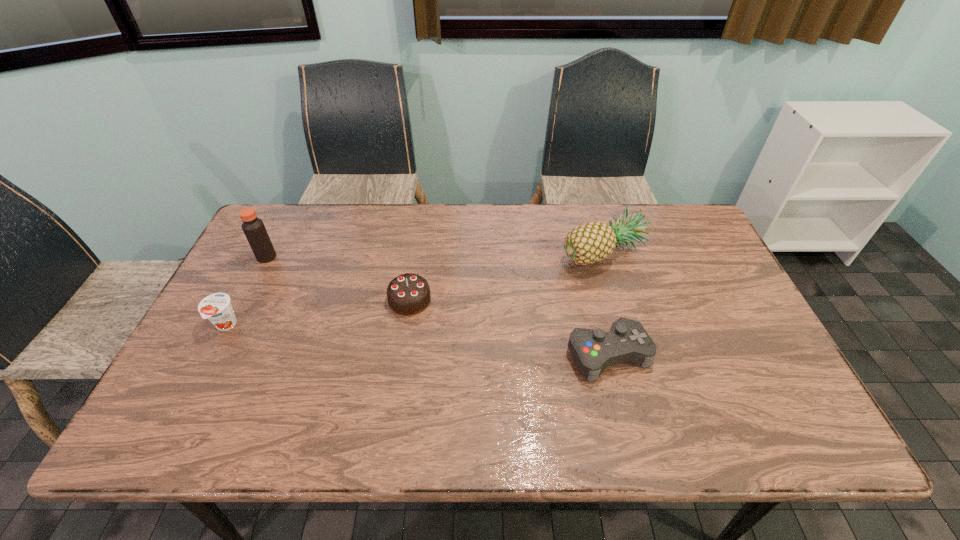
Locate an element on the screen. free region that satisfies the following two spatial constraints: 1. on the back side of the pineapple; 2. on the left side of the third object from left to right is located at coordinates (417, 253).